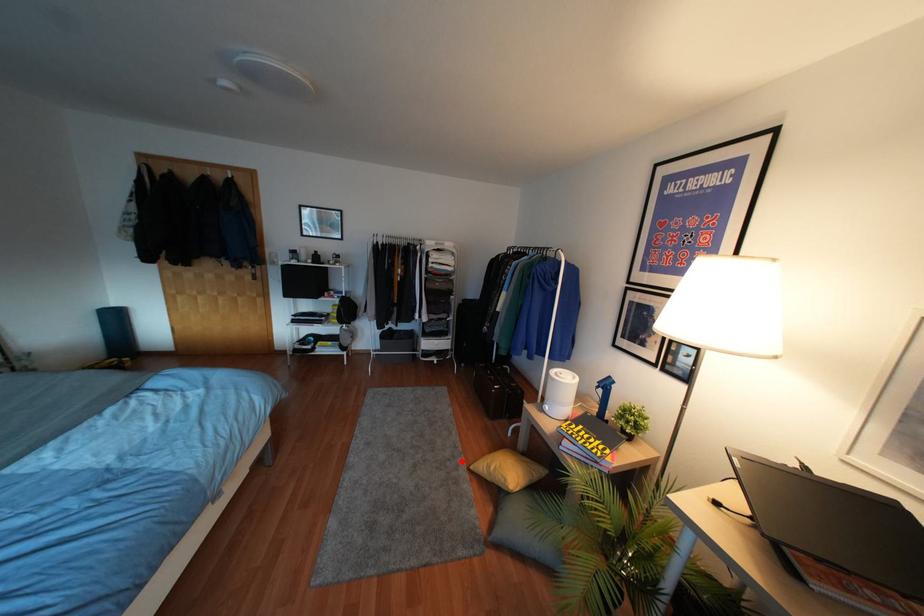
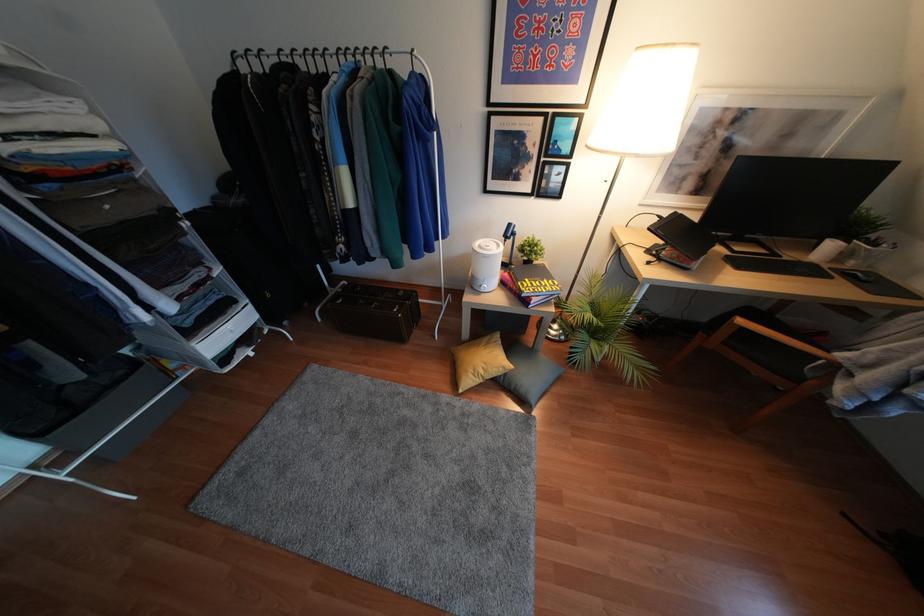
Find the pixel in the second image that matches the highlighted location in the first image.

(445, 397)